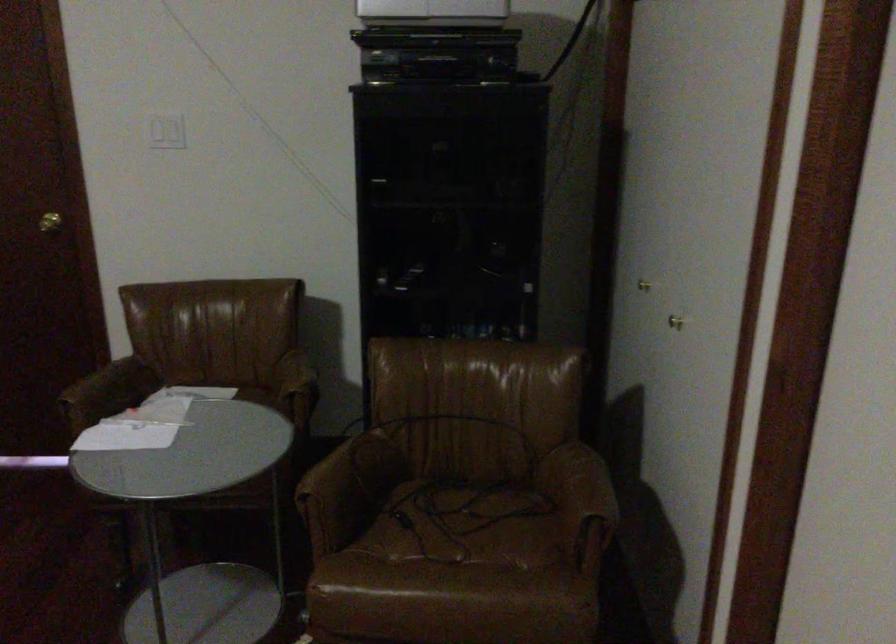
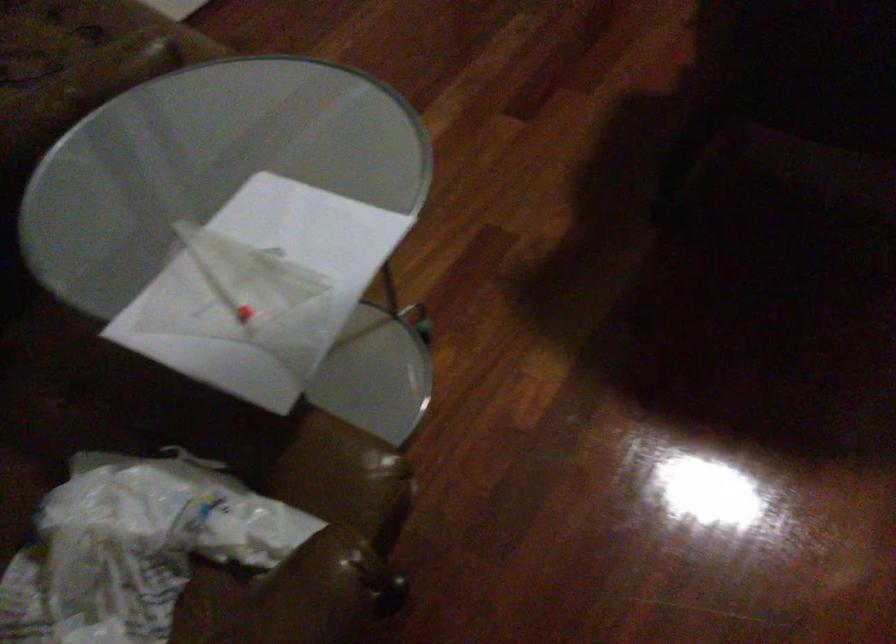
Find the pixel in the second image that matches pixel 159 409 in the first image.

(134, 547)